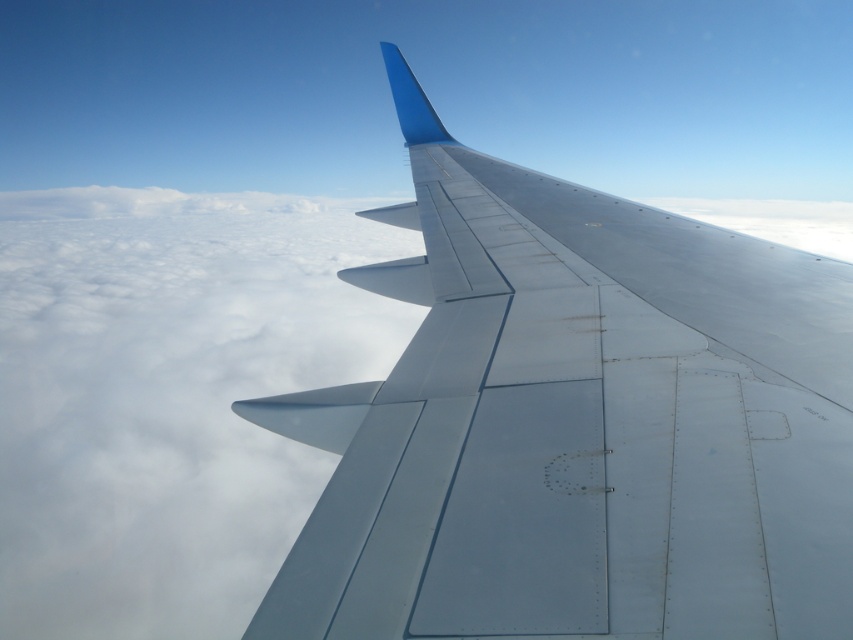
Consider the image. You are seated in an airplane and looking out the window. You notice a point marked at coordinates (577,424) on your window. What object is located at that specific point on the window?

The point at coordinates (577,424) on the window corresponds to the metallic gray wing at center.

You are a passenger sitting in an airplane seat and looking out the window. You notice the metallic gray wing at center and the white fluffy cloud at upper left. Which object is closer to you?

The metallic gray wing at center is closer to you because it is positioned in front of the white fluffy cloud at upper left, which is farther away.

You are seated in an airplane and looking out the window. You notice two points marked on the wing. The first point is at coordinates point (485,596) and the second is at point (416,252). Which point is closer to your eyes?

Point (485,596) is closer to the camera than point (416,252), so the first point is closer to your eyes.